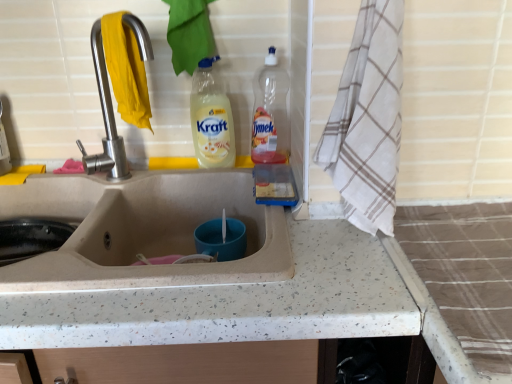
Where is `vacant area that is in front of white checkered towel at right`? vacant area that is in front of white checkered towel at right is located at coordinates (364, 266).